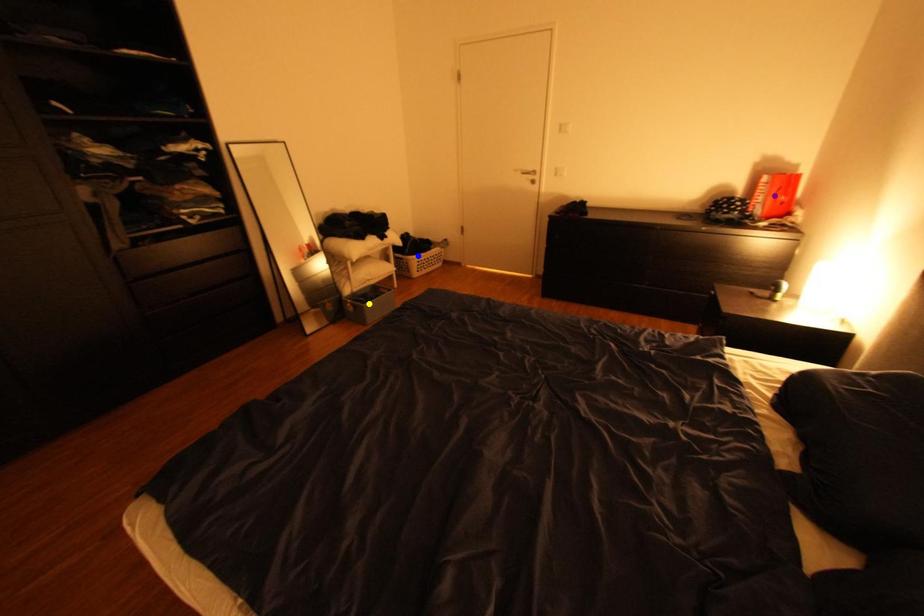
Order these from nearest to farthest:
blue point
yellow point
purple point

blue point
yellow point
purple point